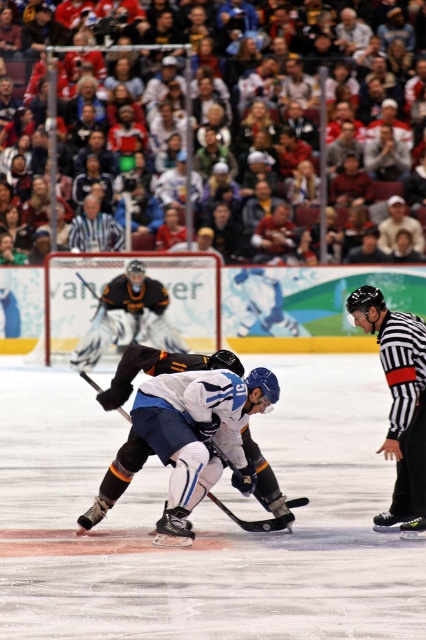
Question: Based on their relative distances, which object is nearer to the striped referee shirt at center?

Choices:
 (A) black matte hockey stick at center
 (B) black and white striped referee at right
 (C) black matte goalie at center

Answer: (C)

Question: Is black matte goalie at center above striped referee shirt at center?

Choices:
 (A) yes
 (B) no

Answer: (B)

Question: Which point is closer to the camera taking this photo?

Choices:
 (A) (86, 225)
 (B) (91, 385)
 (C) (161, 337)
 (D) (388, 445)

Answer: (D)

Question: Is striped referee shirt at center thinner than black matte hockey stick at center?

Choices:
 (A) no
 (B) yes

Answer: (A)

Question: Which object is farther from the camera taking this photo?

Choices:
 (A) striped referee shirt at center
 (B) black and white striped referee at right
 (C) black matte goalie at center
 (D) black matte hockey stick at center

Answer: (A)

Question: Can you confirm if striped referee shirt at center is bigger than black matte hockey stick at center?

Choices:
 (A) no
 (B) yes

Answer: (B)